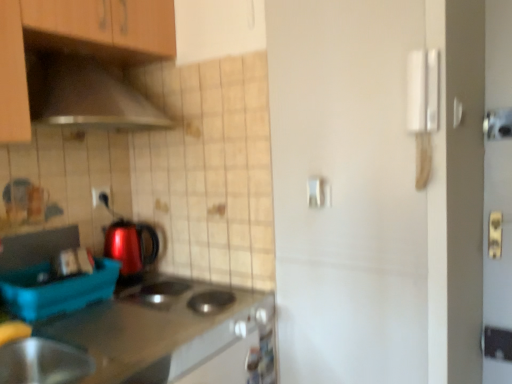
Question: From the image's perspective, is shiny plastic kettle at center-left located above or below blue plastic container at lower left?

Choices:
 (A) below
 (B) above

Answer: (B)

Question: In the image, is shiny plastic kettle at center-left on the left side or the right side of blue plastic container at lower left?

Choices:
 (A) left
 (B) right

Answer: (B)

Question: Estimate the real-world distances between objects in this image. Which object is farther from the wooden cabinet at upper left?

Choices:
 (A) metallic stainless steel countertop at lower left
 (B) matte black outlet at center
 (C) metallic stainless steel bowl at lower left
 (D) white plastic door handle at upper right, the 2th door handle in the bottom-to-top sequence
 (E) white matte door handle at center, which appears as the second door handle when viewed from the top

Answer: (D)

Question: Based on their relative distances, which object is nearer to the metallic stainless steel bowl at lower left?

Choices:
 (A) blue plastic container at lower left
 (B) matte black outlet at center
 (C) metallic stainless steel countertop at lower left
 (D) shiny plastic kettle at center-left
 (E) white plastic door handle at upper right, which appears as the 1th door handle when viewed from the top

Answer: (A)